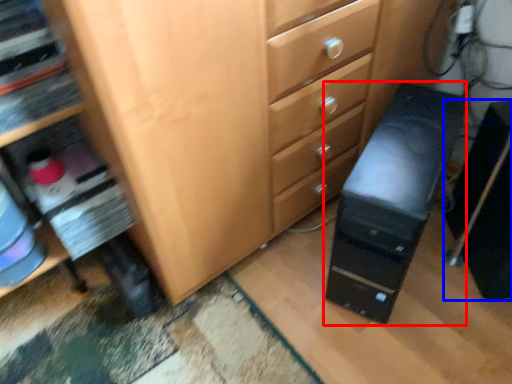
Question: Which object appears closest to the camera in this image, computer tower (highlighted by a red box) or computer tower (highlighted by a blue box)?

Choices:
 (A) computer tower
 (B) computer tower

Answer: (A)